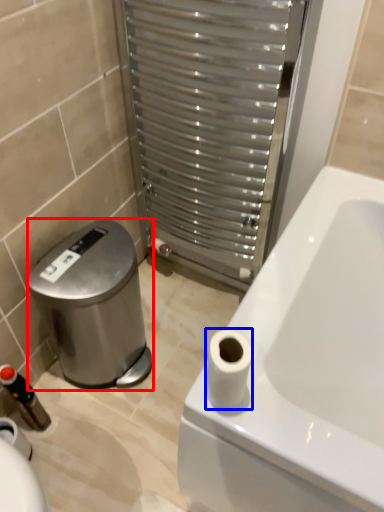
Question: Which object appears closest to the camera in this image, water cooler (highlighted by a red box) or toilet paper (highlighted by a blue box)?

Choices:
 (A) water cooler
 (B) toilet paper

Answer: (B)